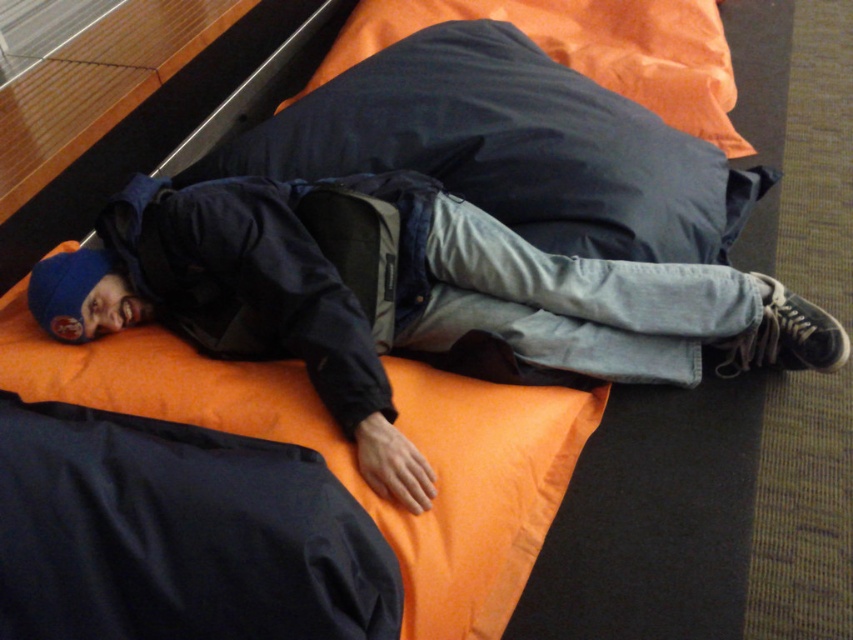
You are a photographer positioned in front of the scene. You want to capture a closeup shot of the dark blue matte jacket at center without the dark blue fabric pillow at upper center appearing in the background. Is this possible given their positions?

The dark blue matte jacket at center is closer to the viewer than the dark blue fabric pillow at upper center, so yes, you can take a closeup shot of the dark blue matte jacket at center while keeping the dark blue fabric pillow at upper center out of the background by adjusting the camera angle or zoom.

You are a delivery robot with a height of 1.5 meters. You need to deliver a package to the person lying down. The package is placed on the floor next to the dark blue matte jacket at center. Can you see the package without bending down?

The dark blue matte jacket at center is 1.28 meters away from the viewer. Since the jacket is at center and the package is next to it, the package is also approximately 1.28 meters away. The robot is 1.5 meters tall, so it can see the package without bending down as the package is on the floor and within the robot height.